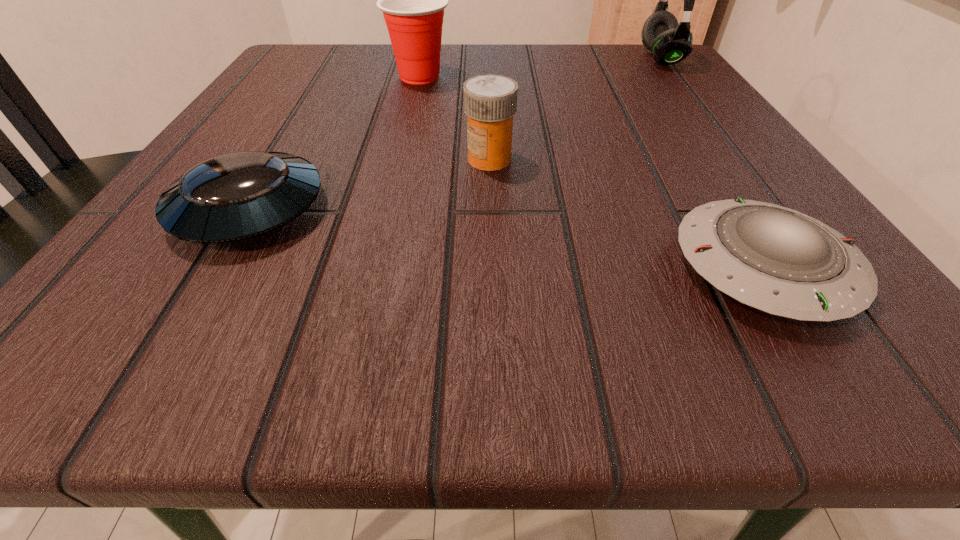
At what (x,y) coordinates should I click in order to perform the action: click on vacant area situated 0.370m on the ear cups of the tallest object. Please return your answer as a coordinate pair (x, y). Looking at the image, I should click on (448, 58).

In order to click on free space located 0.360m on the ear cups of the tallest object in this screenshot , I will do `click(454, 58)`.

The height and width of the screenshot is (540, 960). I want to click on free space located 0.090m on the back of the second object from left to right, so click(426, 47).

Image resolution: width=960 pixels, height=540 pixels. In order to click on vacant space located 0.230m on the label side of the third tallest object in this screenshot , I will do `click(295, 159)`.

Locate an element on the screen. vacant space situated on the label side of the third tallest object is located at coordinates (243, 159).

Where is `free space located on the label side of the third tallest object`? This screenshot has width=960, height=540. free space located on the label side of the third tallest object is located at coordinates (243, 159).

The image size is (960, 540). What are the coordinates of `free location located 0.270m on the right of the left saucer` in the screenshot? It's located at (554, 210).

This screenshot has height=540, width=960. In order to click on blank area located 0.140m on the left of the right saucer in this screenshot , I will do `click(539, 267)`.

This screenshot has height=540, width=960. I want to click on headset at the far edge, so click(670, 42).

At what (x,y) coordinates should I click in order to perform the action: click on cup that is at the far edge. Please return your answer as a coordinate pair (x, y). Looking at the image, I should click on (413, 0).